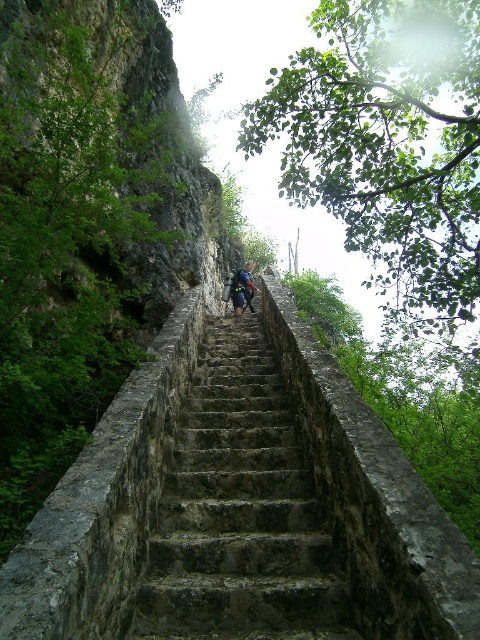
Who is higher up, rusty stone staircase at center or blue fabric backpack at center?

Positioned higher is blue fabric backpack at center.

Does rusty stone staircase at center have a lesser height compared to blue fabric backpack at center?

Correct, rusty stone staircase at center is not as tall as blue fabric backpack at center.

Is point (152, 394) positioned after point (236, 298)?

No.

Where is `rusty stone staircase at center`? This screenshot has width=480, height=640. rusty stone staircase at center is located at coordinates (240, 506).

Which is below, rusty stone stairs at center or blue fabric backpack at center?

Positioned lower is rusty stone stairs at center.

Is point (218, 524) farther from camera compared to point (238, 269)?

That is False.

Does point (322, 592) come farther from viewer compared to point (233, 285)?

No, it is not.

I want to click on rusty stone stairs at center, so click(x=240, y=512).

Does rusty stone staircase at center come in front of rusty stone stairs at center?

Yes, rusty stone staircase at center is in front of rusty stone stairs at center.

Who is shorter, rusty stone staircase at center or rusty stone stairs at center?

rusty stone stairs at center

Where is `rusty stone staircase at center`? rusty stone staircase at center is located at coordinates tap(240, 506).

This screenshot has width=480, height=640. In order to click on rusty stone staircase at center in this screenshot , I will do `click(240, 506)`.